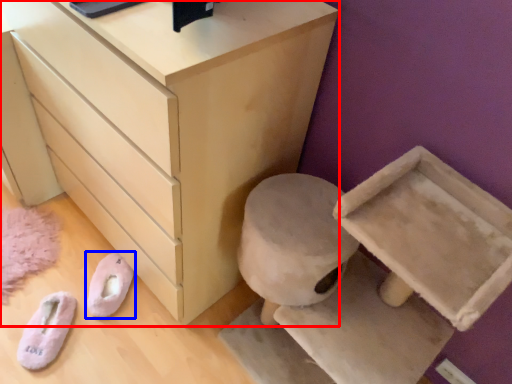
Question: Which object appears farthest to the camera in this image, chest of drawers (highlighted by a red box) or footwear (highlighted by a blue box)?

Choices:
 (A) chest of drawers
 (B) footwear

Answer: (B)